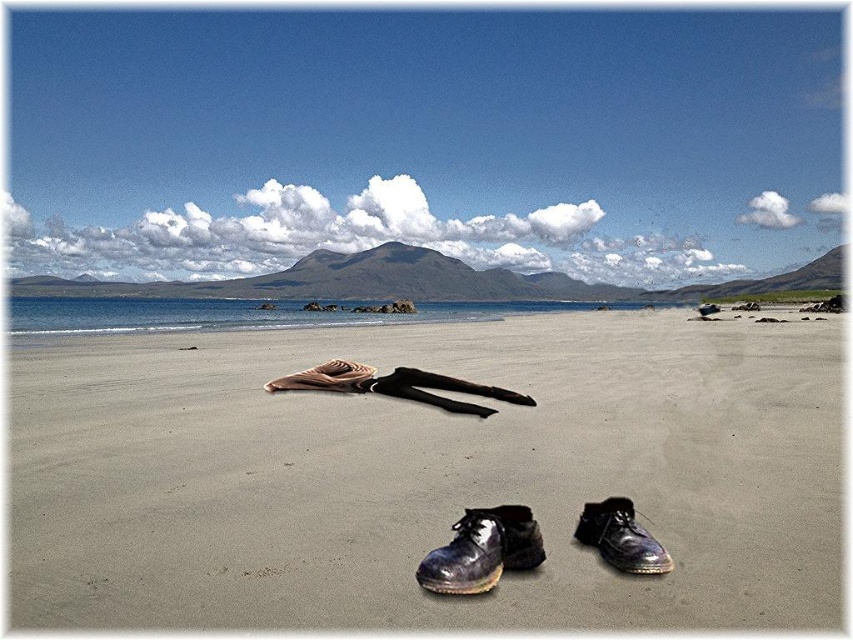
You are standing on the beach and want to walk towards the mountains. You see two points marked on the sand, point 1 at coordinates point 1 at coordinates point (503, 547) and point 2 at coordinates point (502, 556). Which point should you step on first to stay closer to the mountains?

Point 1 at coordinates point (503, 547) is behind point 2 at coordinates point (502, 556). Therefore, to stay closer to the mountains, you should step on point 2 at coordinates point (502, 556) first because it is closer to the mountains compared to point 1.

You are standing on the beach looking at the shiny black boot at lower center and the shiny black shoe at lower right. Which one do you have to walk towards if you want to reach the one that is farther away?

You need to walk towards the shiny black shoe at lower right because it is farther away from you compared to the shiny black boot at lower center.